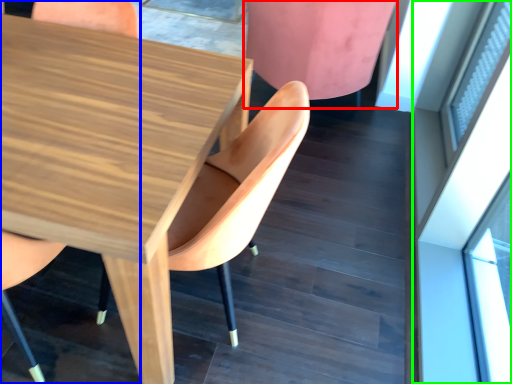
Question: Which is farther away from chair (highlighted by a red box)? chair (highlighted by a blue box) or glass door (highlighted by a green box)?

Choices:
 (A) chair
 (B) glass door

Answer: (A)